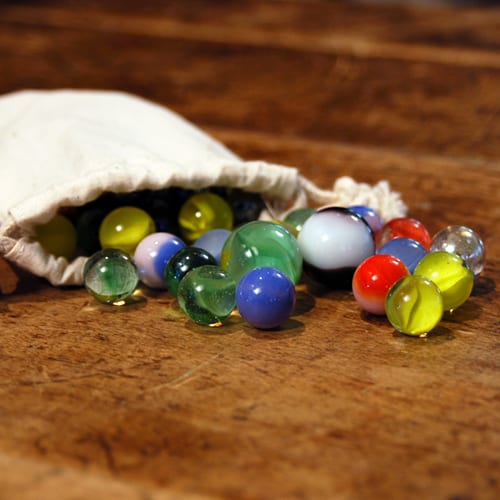
Identify the location of brown table. (311, 423).